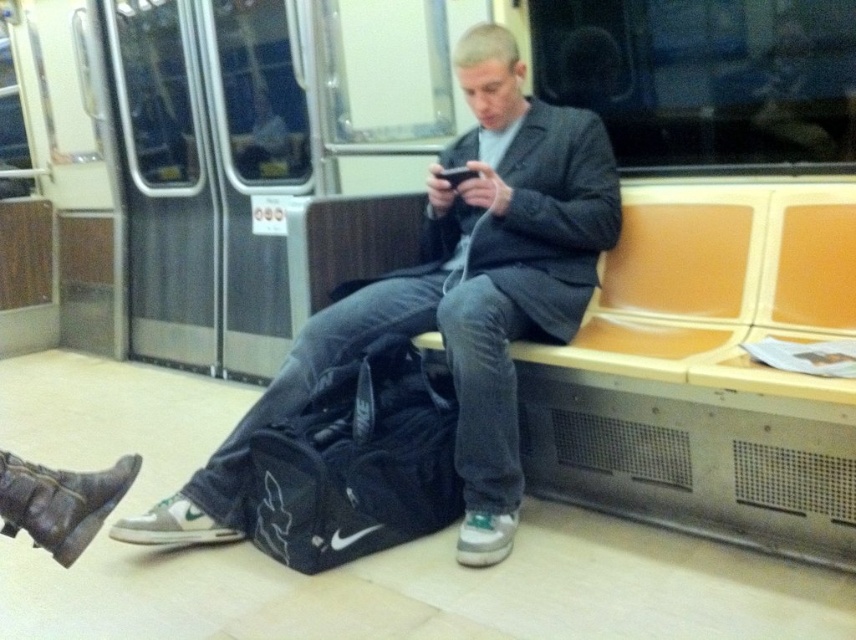
Is metallic silver train at center further to the viewer compared to matte black jacket at center?

Yes, it is behind matte black jacket at center.

At what (x,y) coordinates should I click in order to perform the action: click on metallic silver train at center. Please return your answer as a coordinate pair (x, y). Image resolution: width=856 pixels, height=640 pixels. Looking at the image, I should click on (348, 141).

Identify the location of metallic silver train at center. This screenshot has width=856, height=640. tap(348, 141).

What do you see at coordinates (708, 369) in the screenshot? I see `wooden bench at center` at bounding box center [708, 369].

Between wooden bench at center and navy blue fabric bag at lower center, which one appears on the right side from the viewer's perspective?

Positioned to the right is wooden bench at center.

Locate an element on the screen. The width and height of the screenshot is (856, 640). wooden bench at center is located at coordinates (708, 369).

How far apart are wooden bench at center and matte black jacket at center?

They are 13.75 inches apart.

Who is more distant from viewer, [728,413] or [578,307]?

Point [578,307]

Find the location of a particular element. The image size is (856, 640). wooden bench at center is located at coordinates (708, 369).